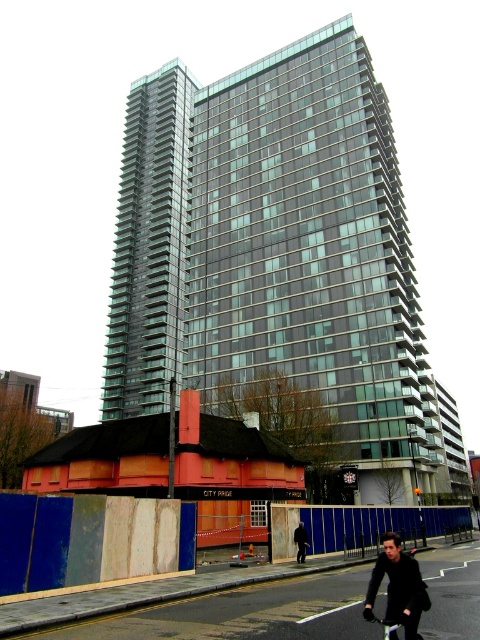
Question: Does dark brown leather jacket at lower center have a greater width compared to black matte bicycle at lower center?

Choices:
 (A) no
 (B) yes

Answer: (B)

Question: Does glassy steel building at center lie in front of dark brown leather jacket at lower center?

Choices:
 (A) no
 (B) yes

Answer: (A)

Question: Which of these objects is positioned closest to the glassy steel building at center?

Choices:
 (A) dark blue jacket at lower right
 (B) dark brown leather jacket at lower center

Answer: (A)

Question: Is glassy steel building at center below black matte bicycle at lower center?

Choices:
 (A) yes
 (B) no

Answer: (B)

Question: Among these points, which one is nearest to the camera?

Choices:
 (A) (396, 566)
 (B) (297, 531)
 (C) (383, 636)
 (D) (380, 234)

Answer: (A)

Question: Estimate the real-world distances between objects in this image. Which object is closer to the dark blue jacket at lower right?

Choices:
 (A) black matte bicycle at lower center
 (B) glassy steel building at center
 (C) dark brown leather jacket at lower center

Answer: (A)